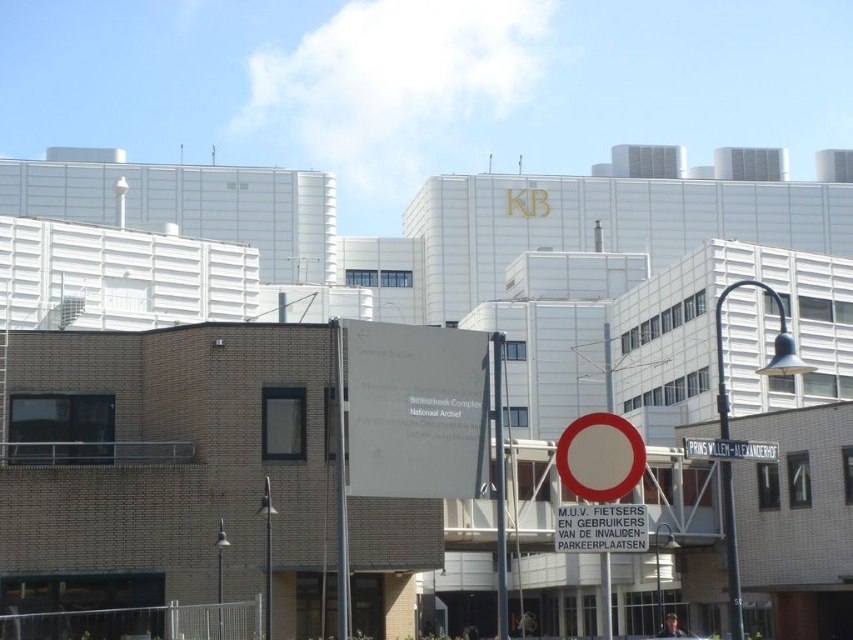
Question: Does metallic pole at center appear under red circle sign at center?

Choices:
 (A) no
 (B) yes

Answer: (B)

Question: Is metallic pole at center smaller than red circle sign at center?

Choices:
 (A) yes
 (B) no

Answer: (B)

Question: Which point is farther to the camera?

Choices:
 (A) red circle sign at center
 (B) metallic pole at center

Answer: (B)

Question: Is metallic pole at center wider than red circle sign at center?

Choices:
 (A) yes
 (B) no

Answer: (B)

Question: Which of the following is the farthest from the observer?

Choices:
 (A) metallic pole at center
 (B) red circle sign at center

Answer: (A)